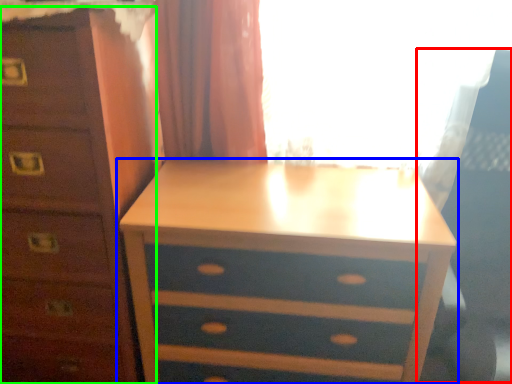
Question: Which object is the closest to the swivel chair (highlighted by a red box)? Choose among these: nightstand (highlighted by a blue box) or chest of drawers (highlighted by a green box).

Choices:
 (A) nightstand
 (B) chest of drawers

Answer: (A)